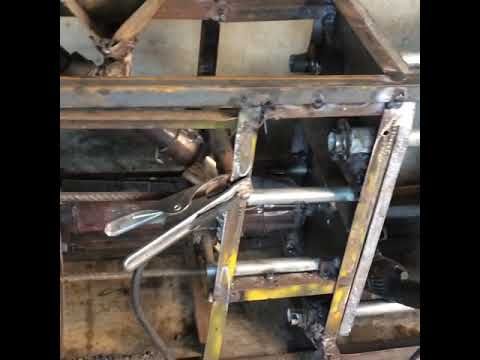
Image resolution: width=480 pixels, height=360 pixels. I want to click on corner, so click(330, 6).